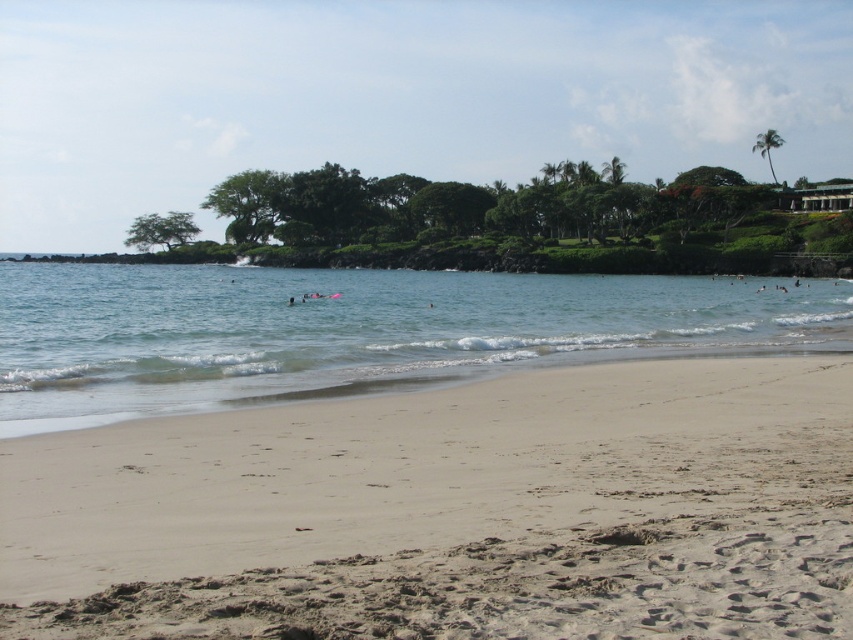
Question: Among these objects, which one is farthest from the camera?

Choices:
 (A) clear blue water at center
 (B) light beige sand at lower center

Answer: (A)

Question: Is light beige sand at lower center wider than clear blue water at center?

Choices:
 (A) yes
 (B) no

Answer: (B)

Question: Is the position of light beige sand at lower center less distant than that of clear blue water at center?

Choices:
 (A) yes
 (B) no

Answer: (A)

Question: Which object is farther from the camera taking this photo?

Choices:
 (A) light beige sand at lower center
 (B) clear blue water at center

Answer: (B)

Question: Is light beige sand at lower center in front of clear blue water at center?

Choices:
 (A) no
 (B) yes

Answer: (B)